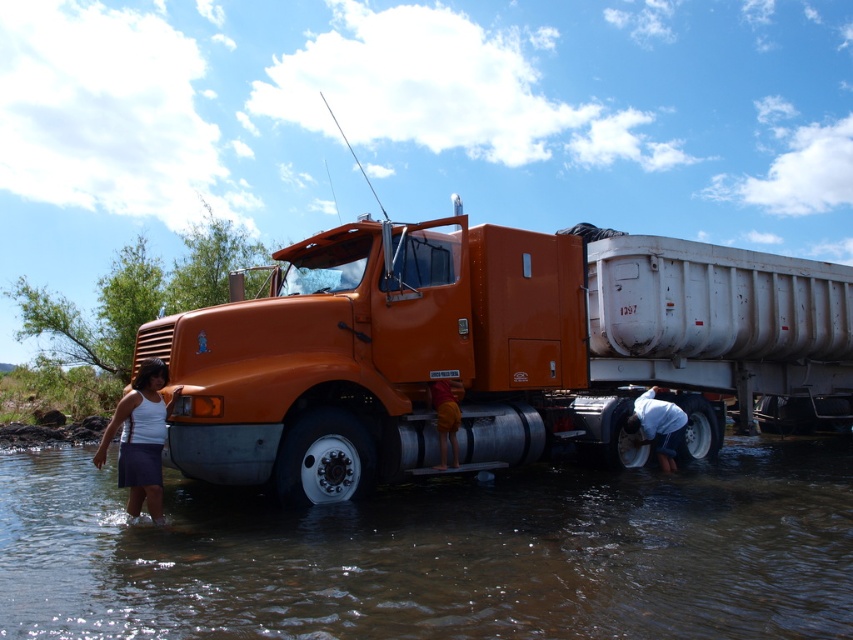
Question: Which point appears farthest from the camera in this image?

Choices:
 (A) (277, 292)
 (B) (149, 426)

Answer: (A)

Question: Which object appears farthest from the camera in this image?

Choices:
 (A) white cotton shirt at lower right
 (B) orange matte truck at center

Answer: (A)

Question: Which of the following is the closest to the observer?

Choices:
 (A) (344, 348)
 (B) (164, 426)
 (C) (639, 422)
 (D) (418, 563)

Answer: (D)

Question: Does orange matte truck at center have a smaller size compared to white fabric skirt at lower left?

Choices:
 (A) no
 (B) yes

Answer: (A)

Question: In this image, where is brown muddy water at lower center located relative to white fabric skirt at lower left?

Choices:
 (A) right
 (B) left

Answer: (A)

Question: Is brown muddy water at lower center smaller than white fabric skirt at lower left?

Choices:
 (A) yes
 (B) no

Answer: (B)